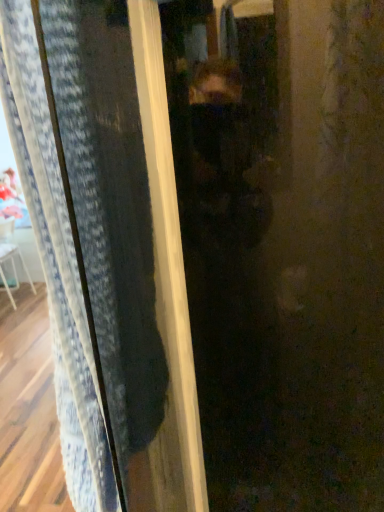
Question: Looking at the image, does white fabric armchair at left seem bigger or smaller compared to transparent plastic screen door at center?

Choices:
 (A) big
 (B) small

Answer: (A)

Question: From a real-world perspective, is white fabric armchair at left physically located above or below transparent plastic screen door at center?

Choices:
 (A) above
 (B) below

Answer: (B)

Question: In terms of height, does white fabric armchair at left look taller or shorter compared to transparent plastic screen door at center?

Choices:
 (A) short
 (B) tall

Answer: (B)

Question: From a real-world perspective, relative to white fabric armchair at left, is transparent plastic screen door at center vertically above or below?

Choices:
 (A) above
 (B) below

Answer: (A)

Question: Is transparent plastic screen door at center wider or thinner than white fabric armchair at left?

Choices:
 (A) wide
 (B) thin

Answer: (B)

Question: In the image, is transparent plastic screen door at center positioned in front of or behind white fabric armchair at left?

Choices:
 (A) behind
 (B) front

Answer: (B)

Question: Looking at the image, does transparent plastic screen door at center seem bigger or smaller compared to white fabric armchair at left?

Choices:
 (A) small
 (B) big

Answer: (A)